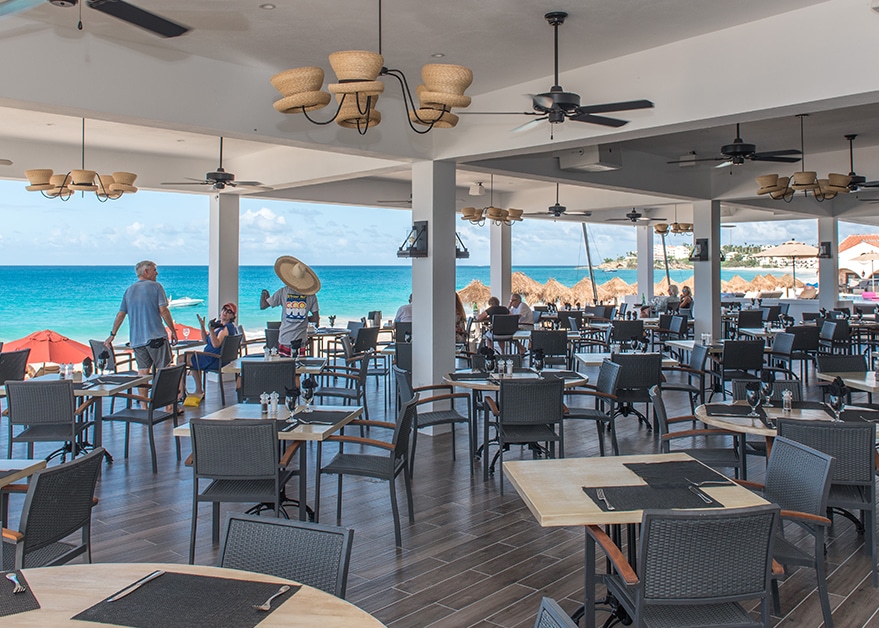
Identify the location of chair. The image size is (879, 628). (539, 420).